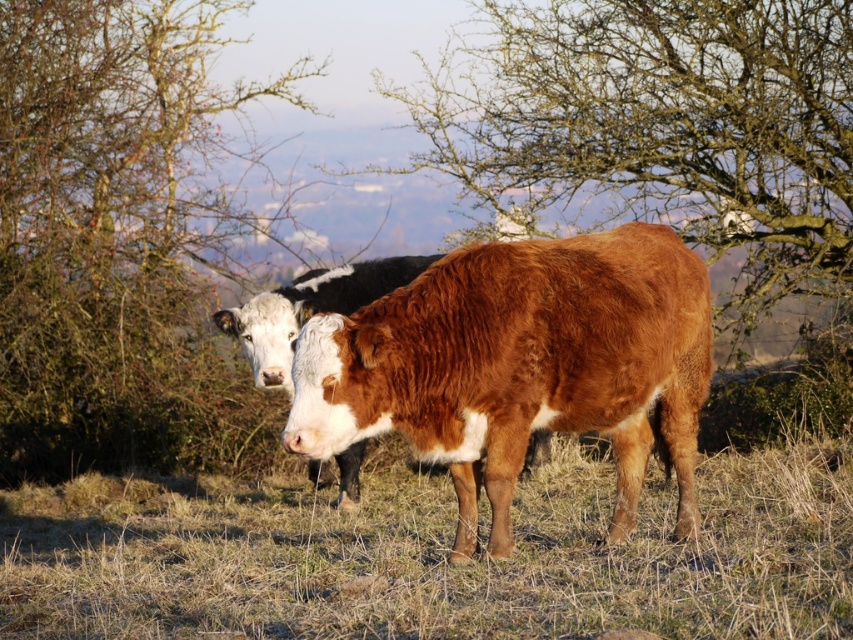
Does brown dry grass at center appear over bare branches at center?

No, brown dry grass at center is not above bare branches at center.

Between brown dry grass at center and bare branches at center, which one is positioned lower?

Positioned lower is brown dry grass at center.

The width and height of the screenshot is (853, 640). Describe the element at coordinates (433, 556) in the screenshot. I see `brown dry grass at center` at that location.

Where is `brown dry grass at center`? brown dry grass at center is located at coordinates (433, 556).

Does bare branches at center have a lesser height compared to brown textured cow at center?

No.

Consider the image. Between bare branches at center and brown textured cow at center, which one appears on the right side from the viewer's perspective?

From the viewer's perspective, bare branches at center appears more on the right side.

Which is behind, point (727, 40) or point (316, 276)?

Positioned behind is point (727, 40).

The width and height of the screenshot is (853, 640). What are the coordinates of `bare branches at center` in the screenshot? It's located at (663, 125).

Between brown dry grass at center and brown furry cow at center, which one has more height?

brown furry cow at center is taller.

Can you confirm if brown dry grass at center is positioned to the left of brown furry cow at center?

In fact, brown dry grass at center is to the right of brown furry cow at center.

The height and width of the screenshot is (640, 853). Describe the element at coordinates (433, 556) in the screenshot. I see `brown dry grass at center` at that location.

At what (x,y) coordinates should I click in order to perform the action: click on brown dry grass at center. Please return your answer as a coordinate pair (x, y). The width and height of the screenshot is (853, 640). Looking at the image, I should click on (433, 556).